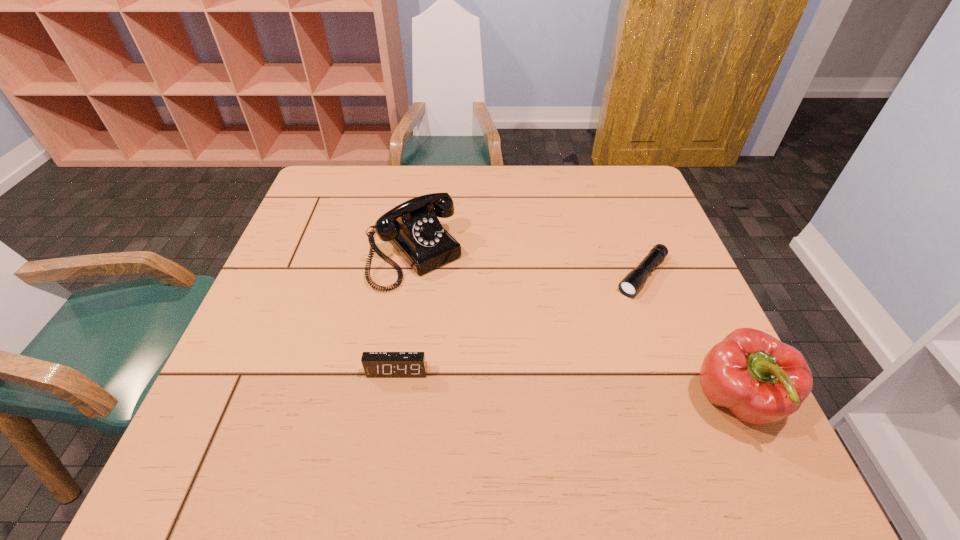
Image resolution: width=960 pixels, height=540 pixels. In order to click on free area in between the telephone and the third tallest object in this screenshot , I will do `click(405, 313)`.

Find the location of a particular element. This screenshot has width=960, height=540. vacant space in between the alarm clock and the pepper is located at coordinates (566, 387).

The image size is (960, 540). I want to click on free point between the shortest object and the pepper, so click(689, 339).

Where is `unoccupied area between the shortest object and the telephone`? This screenshot has width=960, height=540. unoccupied area between the shortest object and the telephone is located at coordinates (528, 265).

Where is `object that is the second closest to the alarm clock`? This screenshot has width=960, height=540. object that is the second closest to the alarm clock is located at coordinates (630, 285).

Identify the location of object that stands as the second closest to the flashlight. Image resolution: width=960 pixels, height=540 pixels. tap(413, 228).

This screenshot has height=540, width=960. In order to click on vacant region that satisfies the following two spatial constraints: 1. on the front-facing side of the alarm clock; 2. on the left side of the pepper in this screenshot , I will do `click(393, 402)`.

You are a GUI agent. You are given a task and a screenshot of the screen. Output one action in this format:
    pyautogui.click(x=<x>, y=<y>)
    Task: Click on the free region that satisfies the following two spatial constraints: 1. on the front-facing side of the second shortest object; 2. on the left side of the pepper
    Image resolution: width=960 pixels, height=540 pixels.
    Given the screenshot: What is the action you would take?
    pyautogui.click(x=393, y=402)

Locate an element on the screen. The image size is (960, 540). free spot that satisfies the following two spatial constraints: 1. on the front side of the telephone; 2. on the left side of the shortest object is located at coordinates (410, 276).